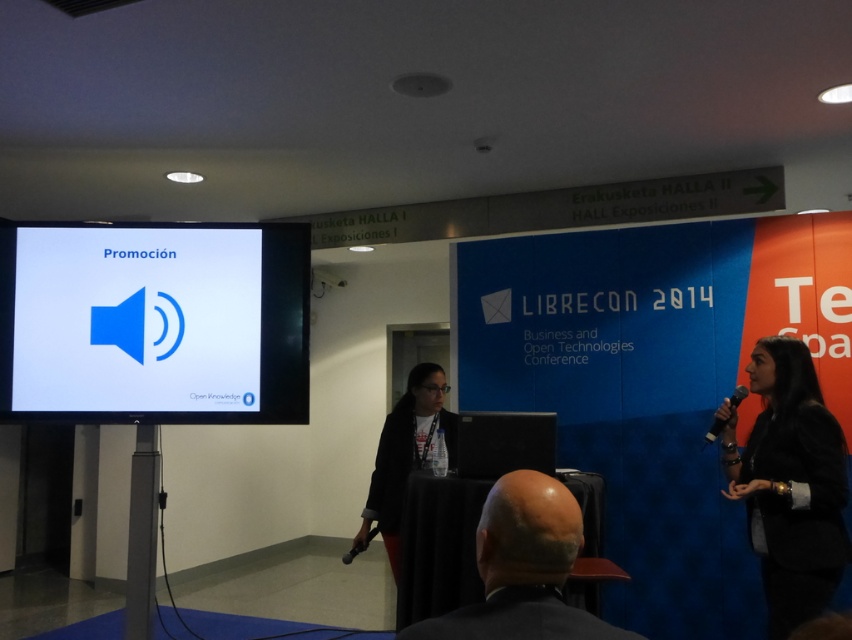
You are a GUI agent. You are given a task and a screenshot of the screen. Output one action in this format:
    pyautogui.click(x=<x>, y=<y>)
    Task: Click on the white glossy projector screen at left
    
    Given the screenshot: What is the action you would take?
    tap(153, 323)

Consider the image. Can you confirm if white glossy projector screen at left is thinner than matte black jacket at center?

No, white glossy projector screen at left is not thinner than matte black jacket at center.

Does point (205, 342) come in front of point (401, 490)?

Yes, it is.

Find the location of a particular element. white glossy projector screen at left is located at coordinates (153, 323).

Is white glossy projector screen at left positioned behind black leather jacket at right?

Yes, it is behind black leather jacket at right.

Can you confirm if white glossy projector screen at left is taller than black leather jacket at right?

In fact, white glossy projector screen at left may be shorter than black leather jacket at right.

Locate an element on the screen. white glossy projector screen at left is located at coordinates (153, 323).

The height and width of the screenshot is (640, 852). What are the coordinates of `white glossy projector screen at left` in the screenshot? It's located at (153, 323).

Which of these two, black leather jacket at right or bald head at lower center, stands shorter?

bald head at lower center

Find the location of a particular element. The width and height of the screenshot is (852, 640). black leather jacket at right is located at coordinates (789, 483).

The width and height of the screenshot is (852, 640). What are the coordinates of `black leather jacket at right` in the screenshot? It's located at (789, 483).